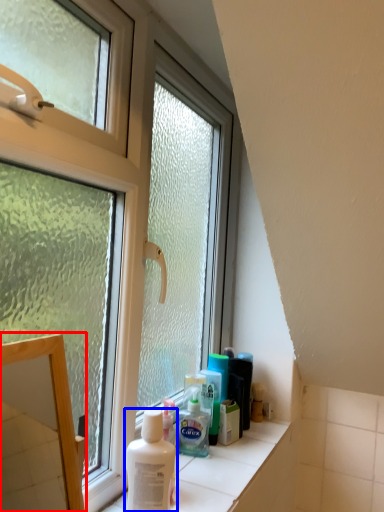
Question: Which object is further to the camera taking this photo, mirror (highlighted by a red box) or shaving cream (highlighted by a blue box)?

Choices:
 (A) mirror
 (B) shaving cream

Answer: (B)